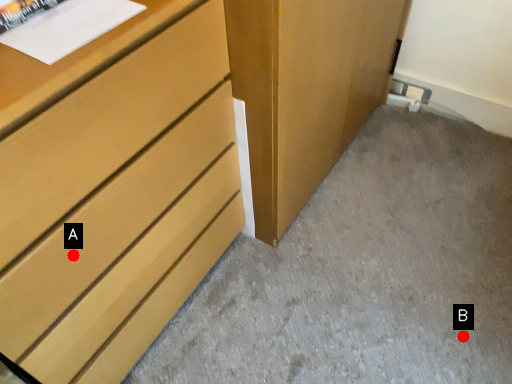
Question: Two points are circled on the image, labeled by A and B beside each circle. Which point appears farthest from the camera in this image?

Choices:
 (A) A is further
 (B) B is further

Answer: (B)